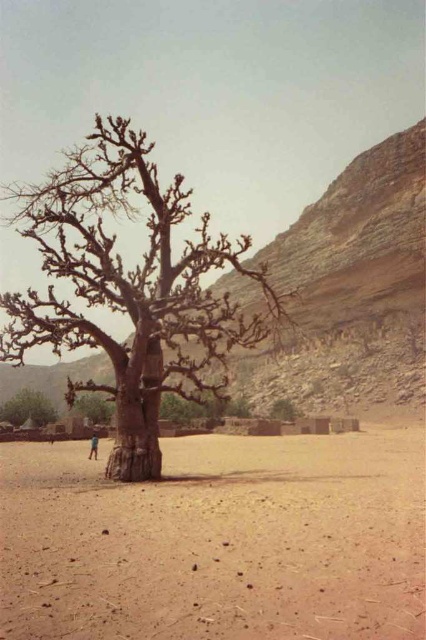
You are an explorer trying to navigate through the arid landscape. You see the brown rough tree at lower left and the brown rough bark tree at center. Which tree is positioned higher in the image?

The brown rough tree at lower left is positioned higher in the image than the brown rough bark tree at center.

You are a hiker who needs to measure the distance between the two brown trees in this desert landscape. Using a measuring tape, can you determine if the distance between the brown rough tree at lower left and the brown rough bark tree at center is more than 20 meters?

The distance between the brown rough tree at lower left and the brown rough bark tree at center is 25.05 meters, which is more than 20 meters, so yes, the distance is more than 20 meters.

You are standing in front of the large, gnarled tree and looking at the two points marked in the image. Which point, point (x=34, y=419) or point (x=285, y=410), is closer to your eyes?

Point (x=34, y=419) is closer to the camera than point (x=285, y=410), so it is closer to your eyes.